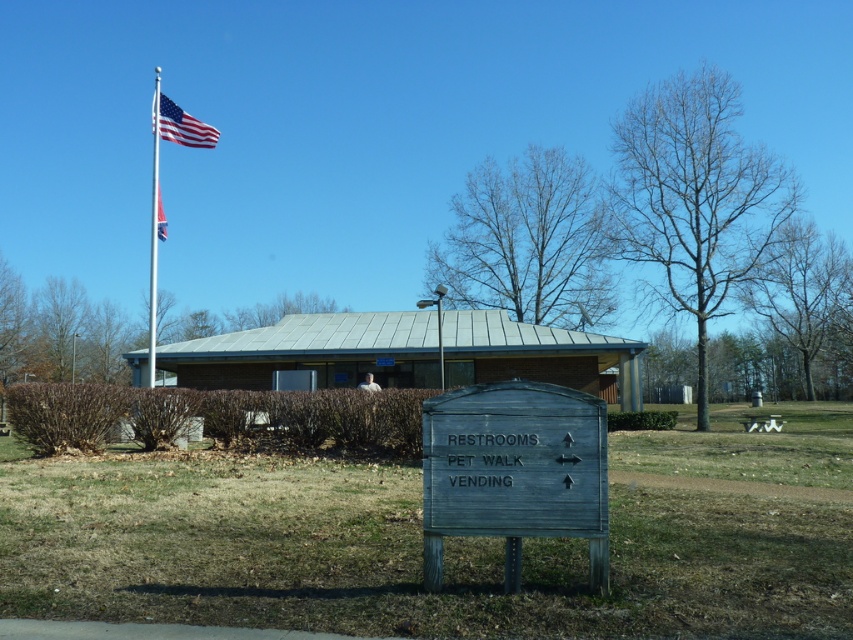
Question: Which point is farther to the camera?

Choices:
 (A) weathered wood sign at center
 (B) american flag at upper left
 (C) metallic flag pole at upper left

Answer: (B)

Question: In this image, where is weathered wood sign at center located relative to metallic flag pole at upper left?

Choices:
 (A) left
 (B) right

Answer: (B)

Question: Among these points, which one is nearest to the camera?

Choices:
 (A) (154, 168)
 (B) (160, 122)
 (C) (473, 403)
 (D) (158, 211)

Answer: (C)

Question: Is weathered wood sign at center below american flag at upper left?

Choices:
 (A) yes
 (B) no

Answer: (A)

Question: Estimate the real-world distances between objects in this image. Which object is farther from the weathered wood sign at center?

Choices:
 (A) polished metallic flag at upper center
 (B) american flag at upper left

Answer: (A)

Question: Can you confirm if metallic flag pole at upper left is positioned above polished metallic flag at upper center?

Choices:
 (A) no
 (B) yes

Answer: (A)